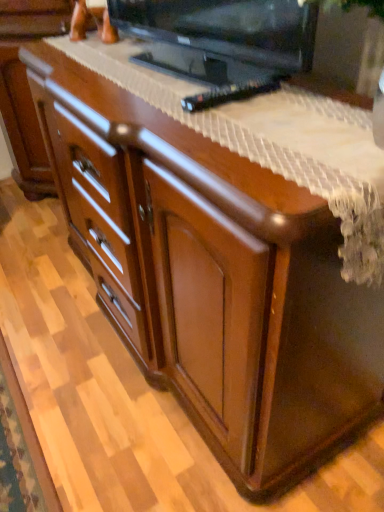
Question: Can you confirm if black glossy television at upper center is wider than black plastic remote at center?

Choices:
 (A) no
 (B) yes

Answer: (B)

Question: Does black glossy television at upper center have a greater height compared to black plastic remote at center?

Choices:
 (A) no
 (B) yes

Answer: (B)

Question: From the image's perspective, does black glossy television at upper center appear higher than black plastic remote at center?

Choices:
 (A) yes
 (B) no

Answer: (A)

Question: Can you confirm if black glossy television at upper center is shorter than black plastic remote at center?

Choices:
 (A) yes
 (B) no

Answer: (B)

Question: From a real-world perspective, is black glossy television at upper center on top of black plastic remote at center?

Choices:
 (A) yes
 (B) no

Answer: (A)

Question: Is black glossy television at upper center oriented away from black plastic remote at center?

Choices:
 (A) yes
 (B) no

Answer: (B)

Question: Can you confirm if black plastic remote at center is bigger than black glossy television at upper center?

Choices:
 (A) no
 (B) yes

Answer: (A)

Question: Does black plastic remote at center come behind black glossy television at upper center?

Choices:
 (A) no
 (B) yes

Answer: (B)

Question: From the image's perspective, is black plastic remote at center located above black glossy television at upper center?

Choices:
 (A) no
 (B) yes

Answer: (A)

Question: From the image's perspective, would you say black plastic remote at center is shown under black glossy television at upper center?

Choices:
 (A) no
 (B) yes

Answer: (B)

Question: Considering the relative positions of black plastic remote at center and black glossy television at upper center in the image provided, is black plastic remote at center to the right of black glossy television at upper center from the viewer's perspective?

Choices:
 (A) yes
 (B) no

Answer: (A)

Question: Could you tell me if black plastic remote at center is turned towards black glossy television at upper center?

Choices:
 (A) no
 (B) yes

Answer: (A)

Question: Is black glossy television at upper center bigger or smaller than black plastic remote at center?

Choices:
 (A) small
 (B) big

Answer: (B)